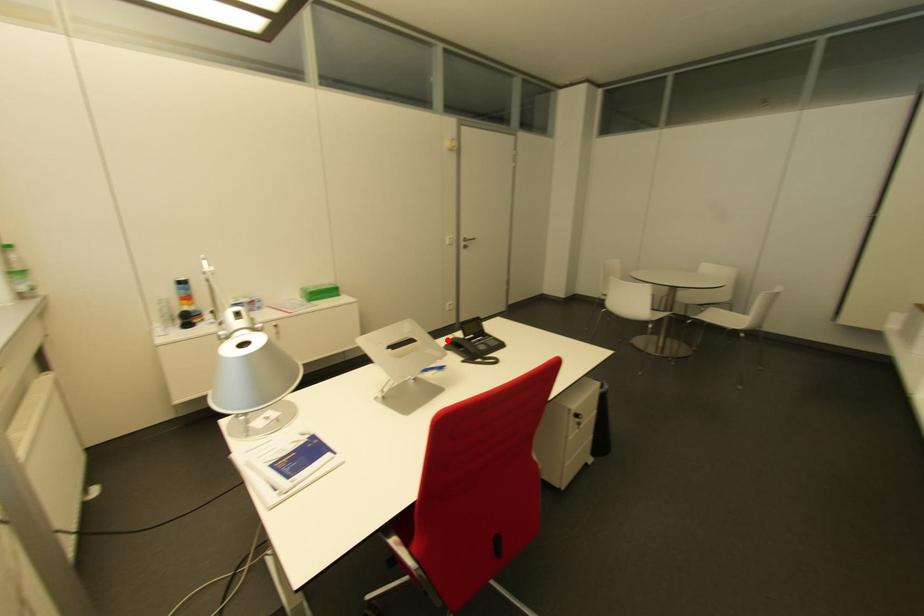
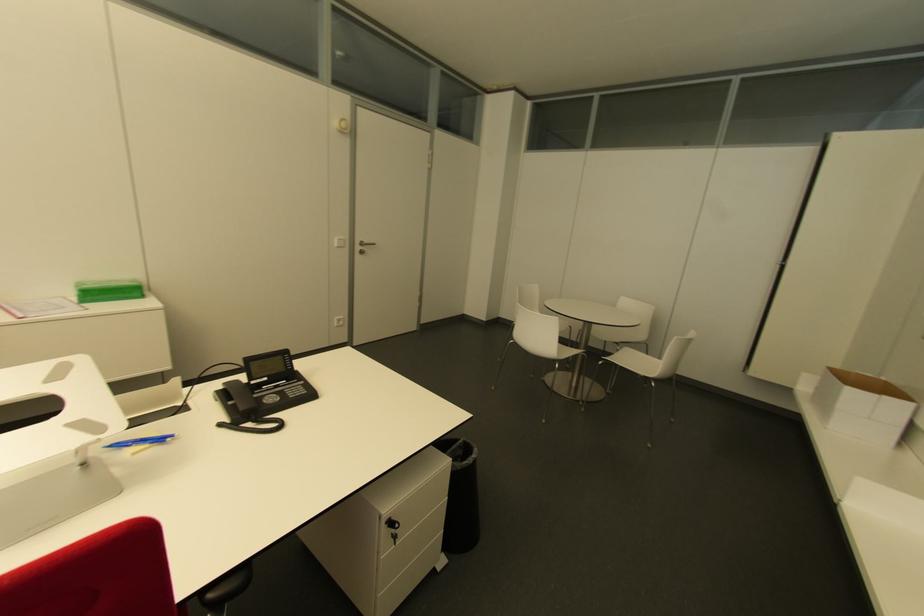
Question: A red point is marked in image1. In image2, is the corresponding 3D point closer to the camera or farther? Reply with the corresponding letter.

Choices:
 (A) The corresponding 3D point is closer.
 (B) The corresponding 3D point is farther.

Answer: (B)